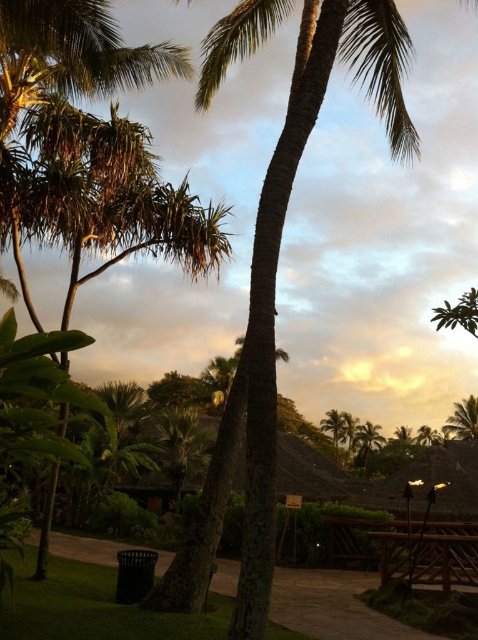
You are standing at the starting point of the pathway and want to walk towards the point marked as point (319, 36). Which direction should you turn to avoid the point marked as point (380, 435)?

Since point (319, 36) is closer to you than point (380, 435), you should walk towards the direction of point (319, 36) and turn away from point (380, 435) to avoid it.

You are standing at point (334, 605) in the tropical scene. What object is located exactly at this coordinate?

The brown wooden path at lower center is located exactly at point (334, 605).

You are planning to set up a small tent for a picnic and need to choose between placing it under the green textured palm tree at center or near the brown wooden picnic table at lower right. Based on their sizes, which location would provide more shade?

The green textured palm tree at center is bigger than the brown wooden picnic table at lower right, so placing the tent under the green textured palm tree at center would provide more shade.